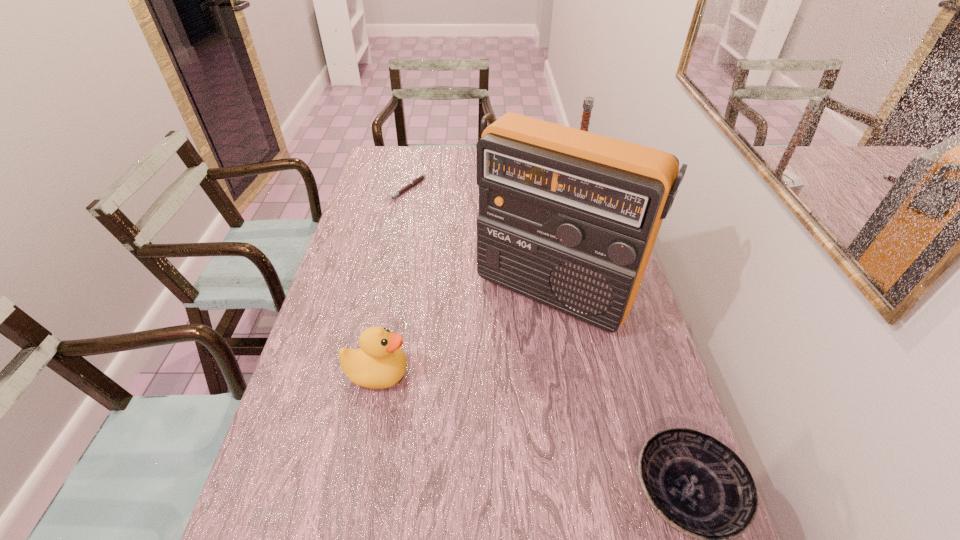
The width and height of the screenshot is (960, 540). Identify the location of free point located on the striking surface of the hammer. (554, 278).

Identify the location of free space located 0.110m on the striking surface of the hammer. This screenshot has height=540, width=960. (564, 232).

At what (x,y) coordinates should I click in order to perform the action: click on vacant space positioned 0.150m on the striking surface of the hammer. Please return your answer as a coordinate pair (x, y). The height and width of the screenshot is (540, 960). Looking at the image, I should click on (562, 239).

This screenshot has width=960, height=540. Identify the location of free space located 0.340m at the nib of the pen. (444, 257).

The image size is (960, 540). In order to click on vacant region located 0.330m at the nib of the pen in this screenshot , I will do `click(443, 255)`.

At what (x,y) coordinates should I click in order to perform the action: click on vacant space located 0.060m at the nib of the pen. Please return your answer as a coordinate pair (x, y). The height and width of the screenshot is (540, 960). Looking at the image, I should click on (417, 210).

Image resolution: width=960 pixels, height=540 pixels. Identify the location of duck that is at the left edge. (380, 363).

This screenshot has width=960, height=540. Identify the location of pen that is at the left edge. (419, 178).

The height and width of the screenshot is (540, 960). What are the coordinates of `radio receiver positioned at the right edge` in the screenshot? It's located at (568, 218).

Identify the location of hammer that is at the right edge. This screenshot has height=540, width=960. (588, 103).